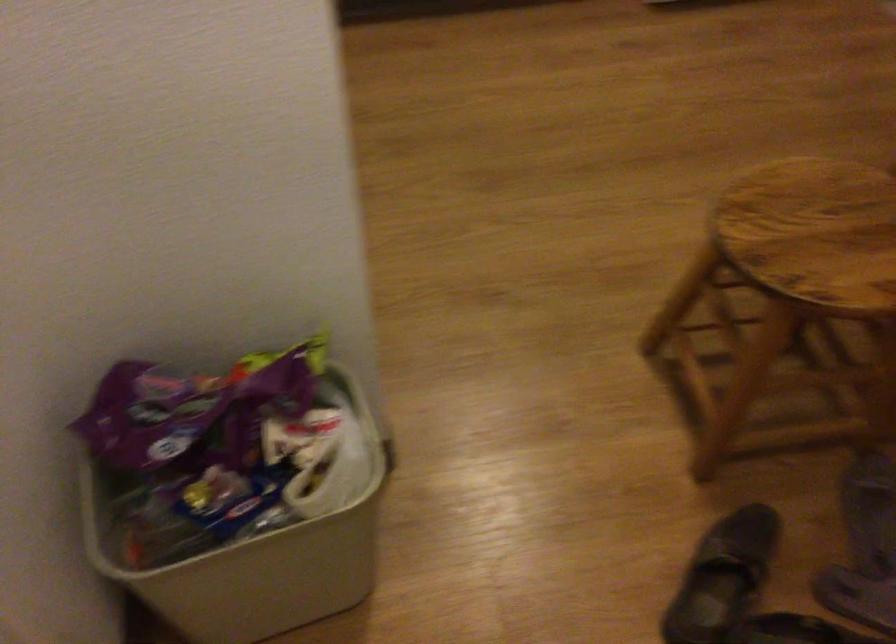
The image size is (896, 644). Find the location of `bin handle`. bin handle is located at coordinates (389, 453).